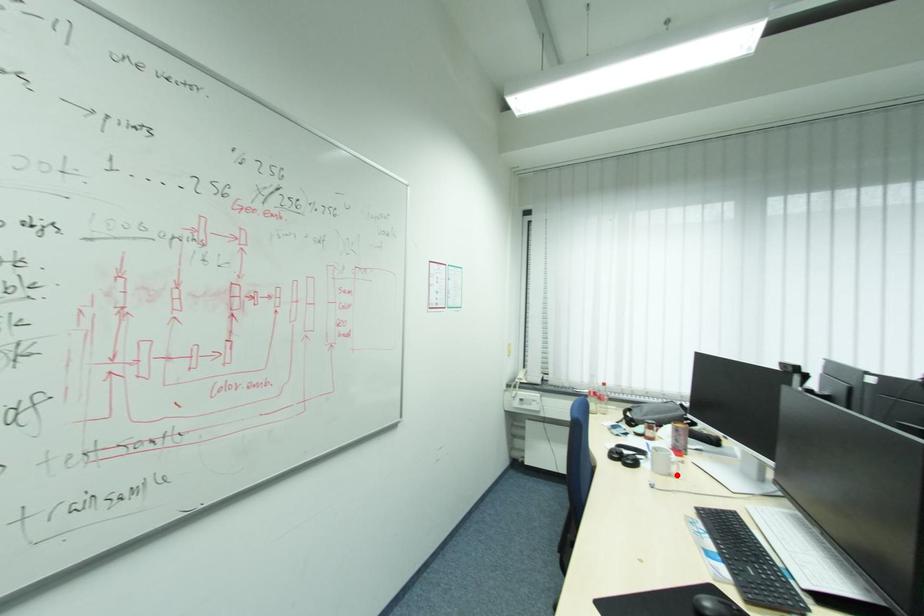
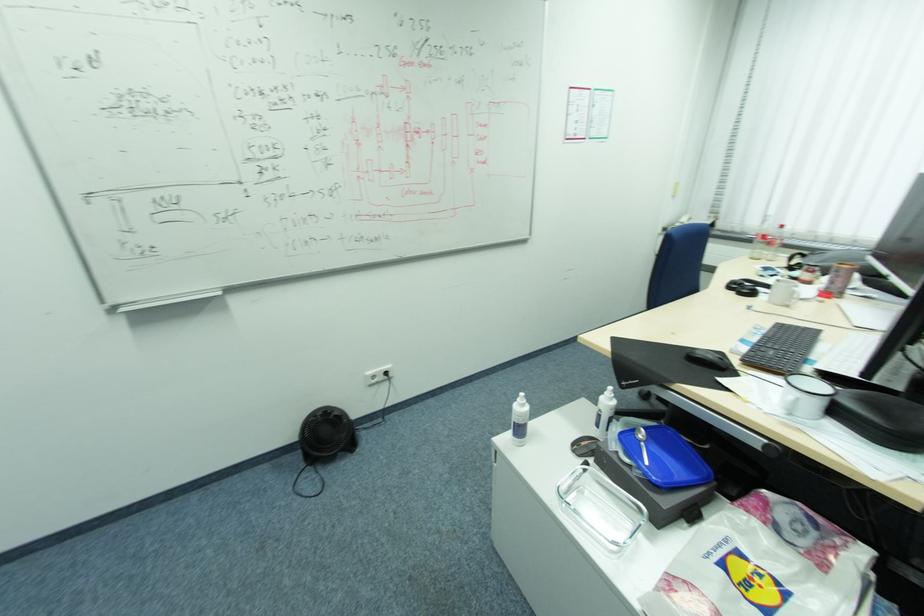
Where in the second image is the point corresponding to the highlighted location from the first image?

(792, 307)